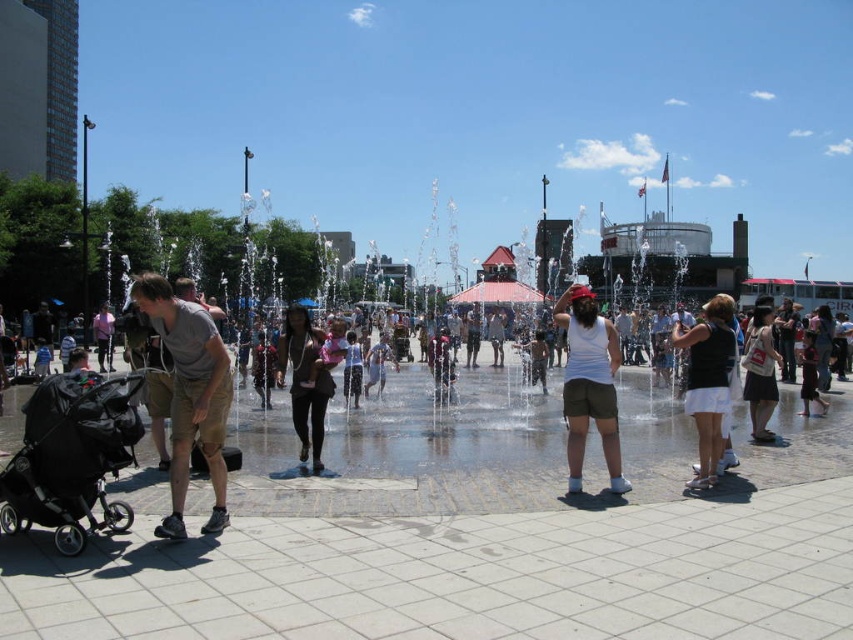
Question: Among these objects, which one is farthest from the camera?

Choices:
 (A) white matte tank top at center
 (B) matte black stroller at left

Answer: (B)

Question: Does matte khaki shorts at center have a lesser width compared to matte black dress at center?

Choices:
 (A) no
 (B) yes

Answer: (B)

Question: Can you confirm if white matte shorts at center is wider than matte black dress at center?

Choices:
 (A) no
 (B) yes

Answer: (B)

Question: Observing the image, what is the correct spatial positioning of dark brown leather jacket at center in reference to matte black stroller at left?

Choices:
 (A) below
 (B) above

Answer: (A)

Question: Estimate the real-world distances between objects in this image. Which object is farther from the white matte shorts at center?

Choices:
 (A) matte khaki shorts at center
 (B) white matte tank top at center
 (C) black matte stroller at lower left
 (D) dark brown leather jacket at center

Answer: (C)

Question: Which of the following is the farthest from the observer?

Choices:
 (A) (757, 380)
 (B) (171, 538)
 (C) (97, 332)
 (D) (323, 392)

Answer: (C)